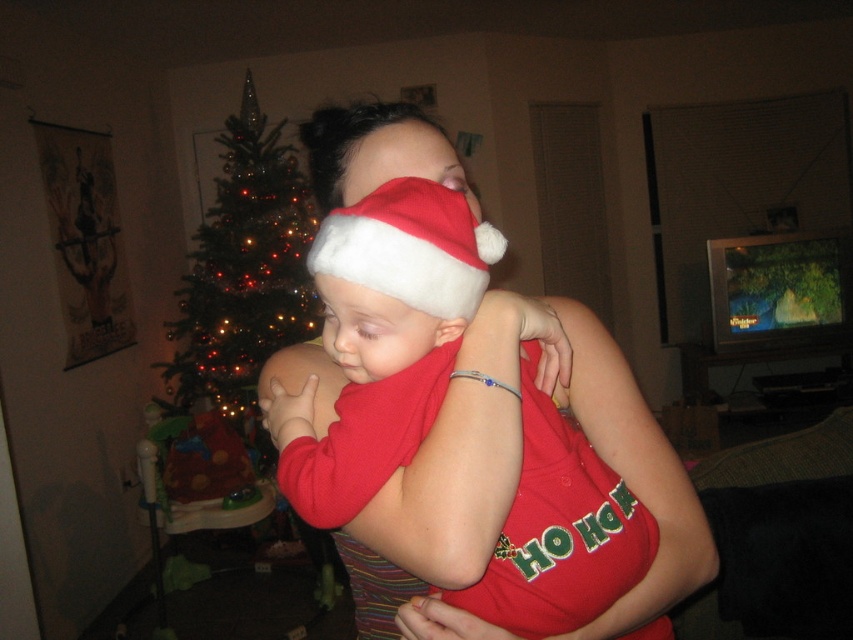
You are a photographer setting up a shot of the festive scene. You need to position a light source to the right of the green artificial christmas tree at left and to the left of the matte red santa hat at center. Is this possible?

The matte red santa hat at center is to the right of the green artificial christmas tree at left, so placing the light source between them would require it to be to the right of the tree and to the left of the hat, which is feasible since they are positioned in that order from left to right.

You are taking a photo with a camera and want to include both the matte red santa hat at center and the woman holding the baby in the frame. Can you fit both in the photo without moving the camera?

The matte red santa hat at center and camera are 26.23 inches apart. Since the distance between them is fixed, you can adjust the camera zoom to ensure both the matte red santa hat at center and the woman holding the baby are in the frame.

From the picture: You are a gift wrapper who needs to choose a hat for a small baby. The matte red santa hat at center and the white fluffy santa hat at center are available. Which hat would be more suitable based on size?

The white fluffy santa hat at center is smaller and would be more suitable for a small baby since the matte red santa hat at center is bigger.